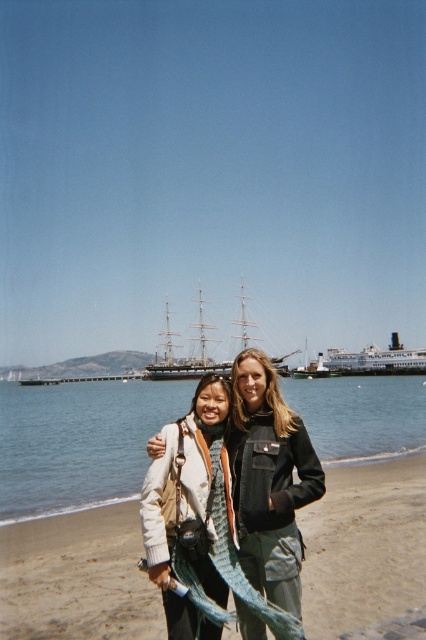
Between sandy brown at lower center and blue water at center, which one appears on the left side from the viewer's perspective?

Positioned to the left is blue water at center.

Which is above, sandy brown at lower center or blue water at center?

sandy brown at lower center

Who is more forward, (46, 595) or (311, 433)?

Point (46, 595) is in front.

Locate an element on the screen. This screenshot has height=640, width=426. sandy brown at lower center is located at coordinates (365, 547).

Is point (333, 365) closer to viewer compared to point (238, 321)?

Yes, it is in front of point (238, 321).

Can you confirm if white glossy ferry at center is positioned to the left of wooden ship at center?

In fact, white glossy ferry at center is to the right of wooden ship at center.

This screenshot has height=640, width=426. Identify the location of white glossy ferry at center. (377, 358).

Where is `white glossy ferry at center`? Image resolution: width=426 pixels, height=640 pixels. white glossy ferry at center is located at coordinates pyautogui.click(x=377, y=358).

Is blue water at center positioned in front of teal fabric scarf at center?

No, it is not.

Between point (77, 396) and point (244, 378), which one is positioned behind?

The point (77, 396) is behind.

This screenshot has height=640, width=426. In order to click on blue water at center in this screenshot , I will do `click(78, 442)`.